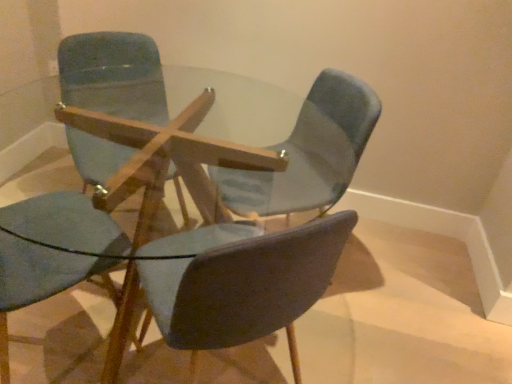
Locate an element on the screen. This screenshot has width=512, height=384. free location to the right of matte blue chair at center, which is the second chair in right-to-left order is located at coordinates (341, 345).